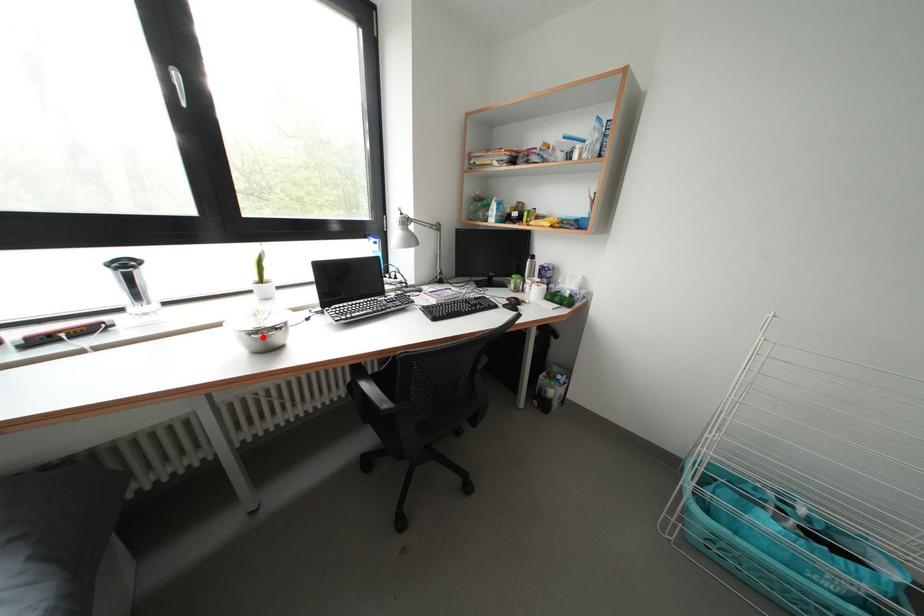
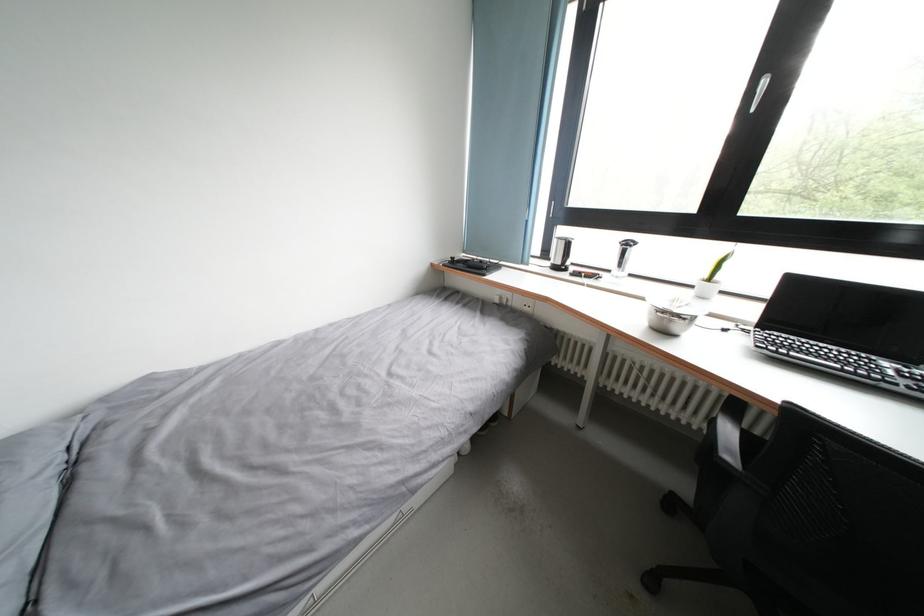
Where in the second image is the point corresponding to the highlighted location from the first image?

(670, 317)